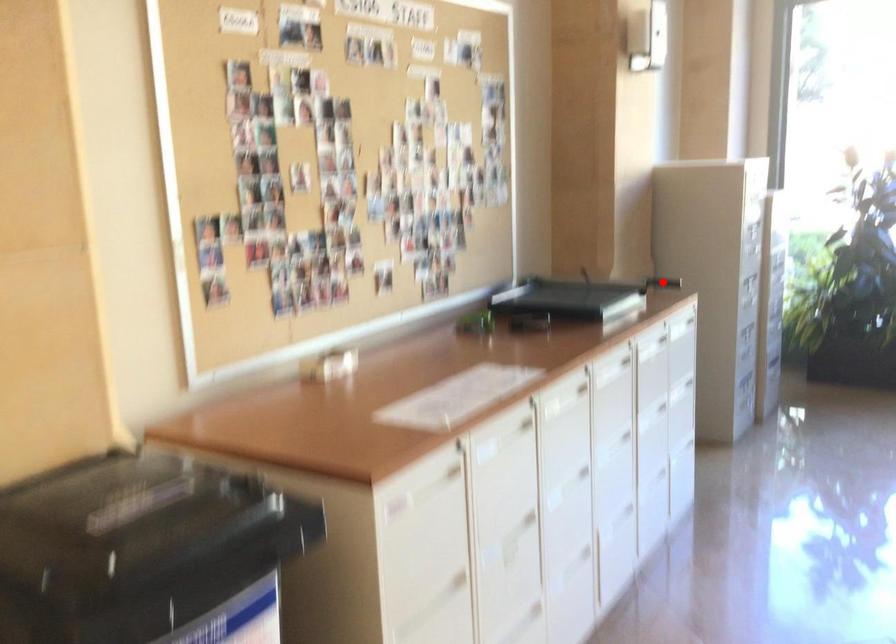
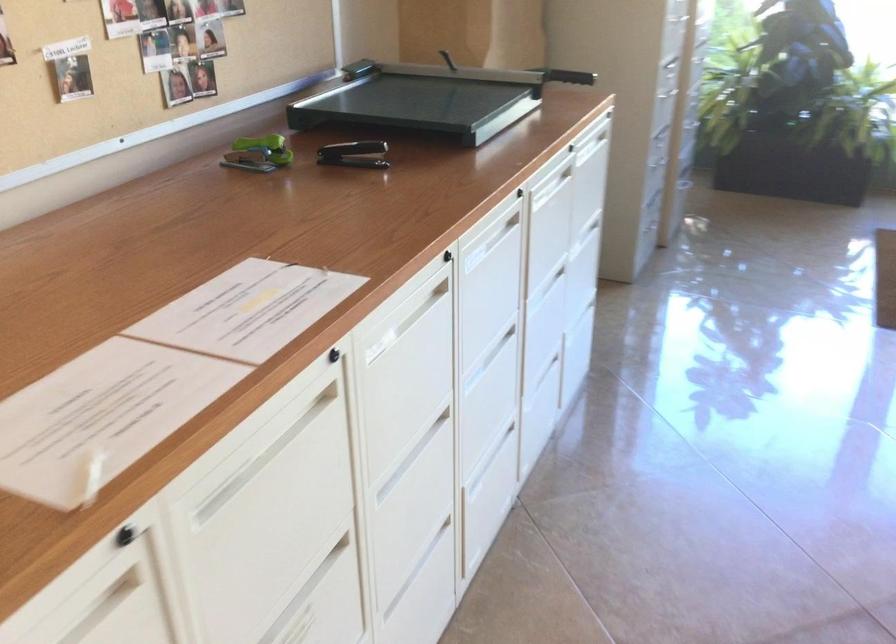
Question: I am providing you with two images of the same scene from different viewpoints. A red point is marked on the first image. At the location where the point appears in image 1, is it still visible in image 2?

Choices:
 (A) Yes
 (B) No

Answer: (B)